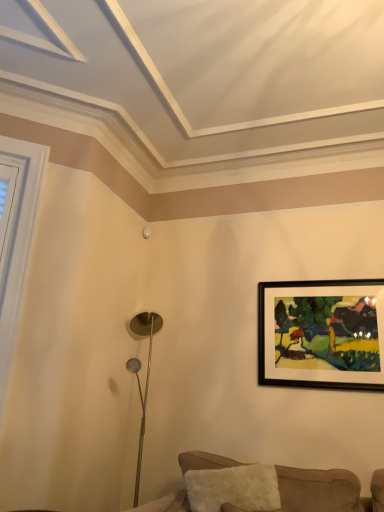
Question: Should I look upward or downward to see black matte picture frame at upper right?

Choices:
 (A) up
 (B) down

Answer: (B)